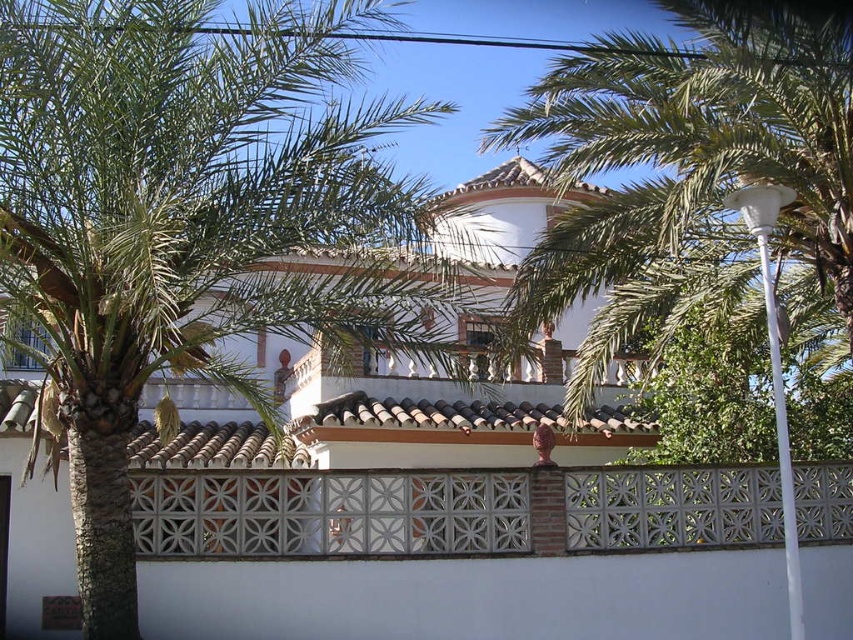
Can you confirm if green leafy palm tree at left is positioned above white textured tile fence at center?

Correct, green leafy palm tree at left is located above white textured tile fence at center.

Between green leafy palm tree at left and white textured tile fence at center, which one has more height?

green leafy palm tree at left is taller.

Image resolution: width=853 pixels, height=640 pixels. Identify the location of green leafy palm tree at left. (189, 221).

Find the location of a particular element. Image resolution: width=853 pixels, height=640 pixels. green leafy palm tree at left is located at coordinates (189, 221).